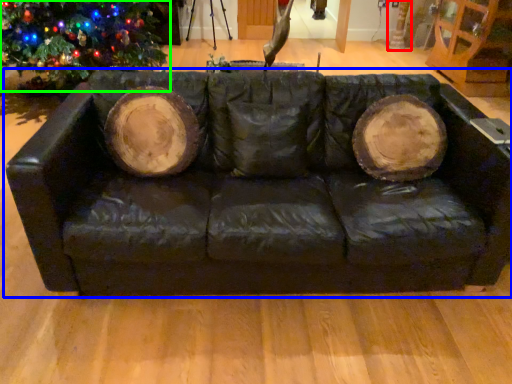
Question: Considering the real-world distances, which object is closest to tree trunk (highlighted by a red box)? studio couch (highlighted by a blue box) or christmas tree (highlighted by a green box).

Choices:
 (A) studio couch
 (B) christmas tree

Answer: (B)